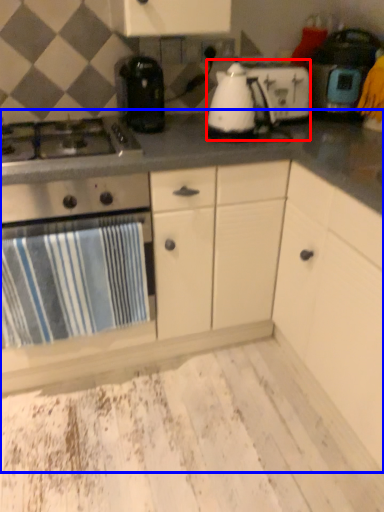
Question: Which object appears closest to the camera in this image, kitchen appliance (highlighted by a red box) or countertop (highlighted by a blue box)?

Choices:
 (A) kitchen appliance
 (B) countertop

Answer: (B)